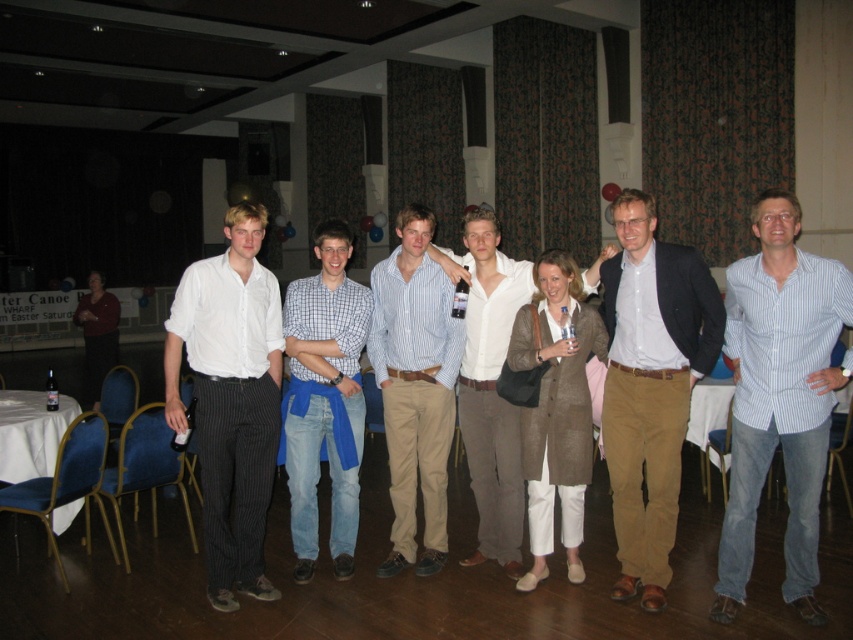
Question: Which point appears closest to the camera in this image?

Choices:
 (A) (480, 252)
 (B) (798, 435)
 (C) (432, 465)
 (D) (705, 358)

Answer: (B)

Question: Estimate the real-world distances between objects in this image. Which object is farther from the matte white shirt at center?

Choices:
 (A) white shirt at center
 (B) striped cotton shirt at center

Answer: (B)

Question: Among these objects, which one is nearest to the camera?

Choices:
 (A) matte white shirt at center
 (B) blue striped shirt at center
 (C) white cotton shirt at center
 (D) blue denim jeans at center

Answer: (B)

Question: Is blue striped shirt at center below matte white shirt at center?

Choices:
 (A) no
 (B) yes

Answer: (B)

Question: Does striped cotton shirt at center lie in front of blue denim jeans at center?

Choices:
 (A) yes
 (B) no

Answer: (B)

Question: Does blue striped shirt at center have a smaller size compared to white shirt at center?

Choices:
 (A) no
 (B) yes

Answer: (A)